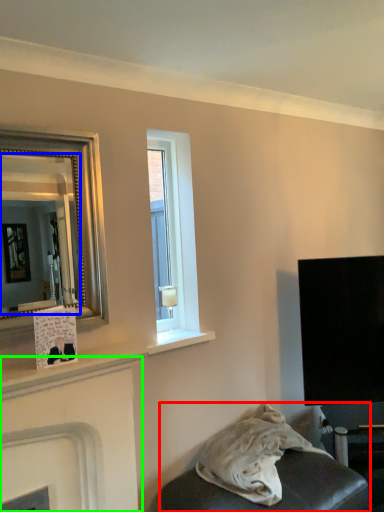
Question: Which is farther away from furniture (highlighted by a red box)? mirror (highlighted by a blue box) or fireplace (highlighted by a green box)?

Choices:
 (A) mirror
 (B) fireplace

Answer: (A)